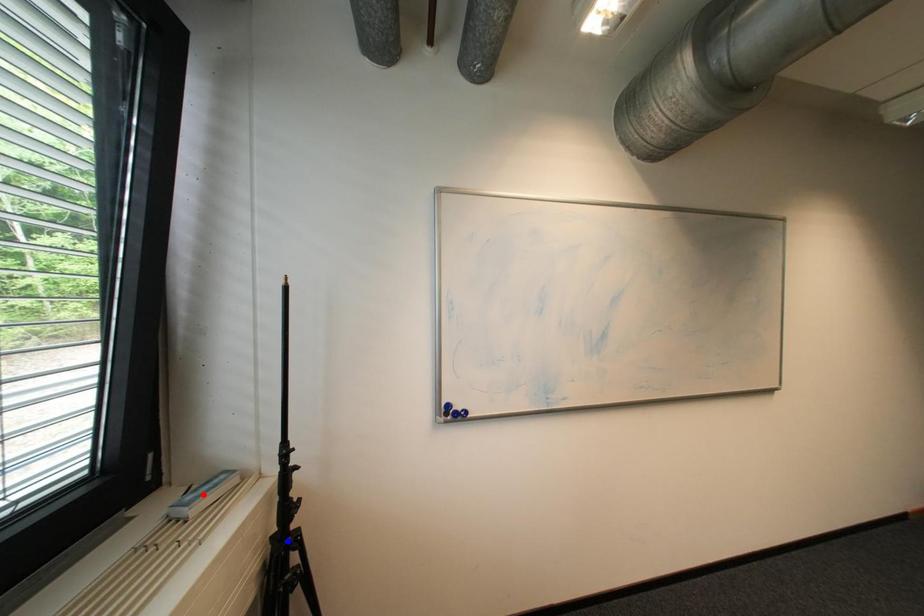
Question: Which of the two points in the image is closer to the camera?

Choices:
 (A) Blue point is closer.
 (B) Red point is closer.

Answer: (B)